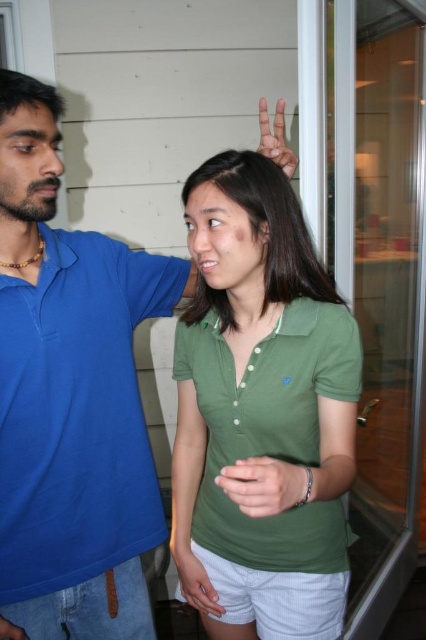
Which of these two, matte green wristband at lower center or matte blue hand at upper right, stands shorter?

Standing shorter between the two is matte blue hand at upper right.

From the picture: Can you confirm if matte green wristband at lower center is positioned above matte blue hand at upper right?

No, matte green wristband at lower center is not above matte blue hand at upper right.

This screenshot has height=640, width=426. Find the location of `matte green wristband at lower center`. matte green wristband at lower center is located at coordinates (198, 579).

I want to click on matte green wristband at lower center, so click(x=198, y=579).

The width and height of the screenshot is (426, 640). Identify the location of transparent glass door at center. (382, 280).

The width and height of the screenshot is (426, 640). Find the location of `transparent glass door at center`. transparent glass door at center is located at coordinates (382, 280).

Is green matte shirt at center bigger than transparent glass door at center?

Actually, green matte shirt at center might be smaller than transparent glass door at center.

Can you confirm if green matte shirt at center is smaller than transparent glass door at center?

Yes, green matte shirt at center is smaller than transparent glass door at center.

Is point (226, 605) behind point (382, 417)?

No, it is in front of (382, 417).

What are the coordinates of `green matte shirt at center` in the screenshot? It's located at tap(261, 396).